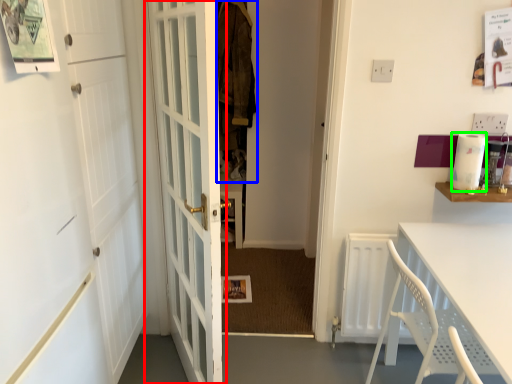
Question: Estimate the real-world distances between objects in this image. Which object is closer to door (highlighted by a red box), laundry (highlighted by a blue box) or appliance (highlighted by a green box)?

Choices:
 (A) laundry
 (B) appliance

Answer: (A)